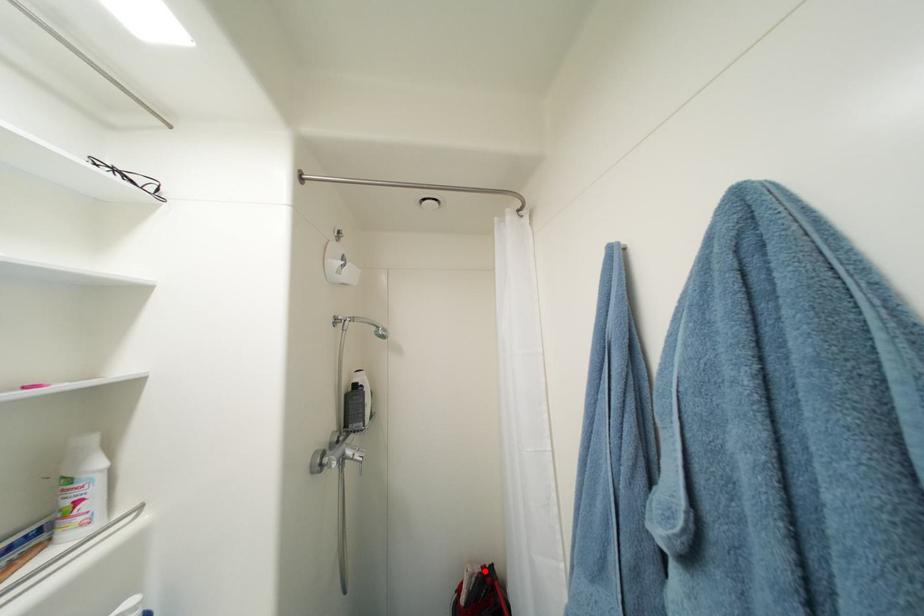
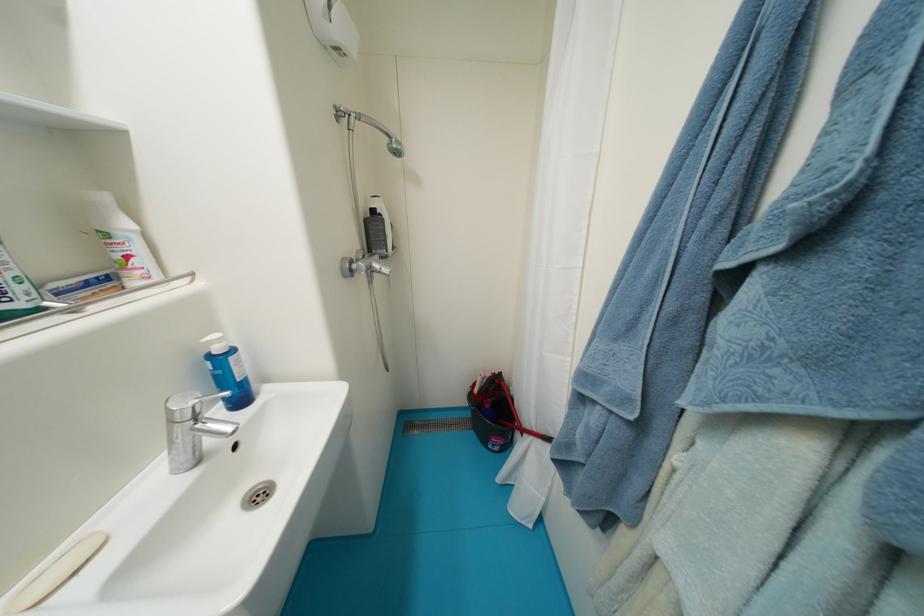
The point at the highlighted location is marked in the first image. Where is the corresponding point in the second image?

(495, 377)